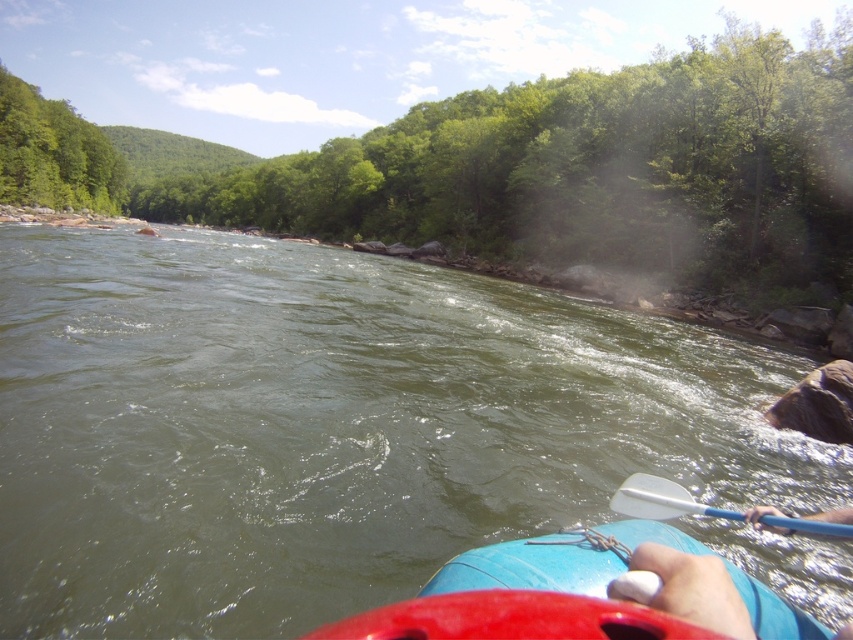
Question: Does green rubber raft at center have a greater width compared to blue rubber canoe at lower center?

Choices:
 (A) yes
 (B) no

Answer: (A)

Question: Which point is farther to the camera?

Choices:
 (A) green rubber raft at center
 (B) green leafy tree at upper center

Answer: (B)

Question: Does green leafy tree at upper left come behind white plastic paddle at lower center?

Choices:
 (A) yes
 (B) no

Answer: (A)

Question: Which of these objects is positioned closest to the blue rubber canoe at lower center?

Choices:
 (A) green leafy tree at upper left
 (B) white plastic paddle at lower center
 (C) green rubber raft at center

Answer: (B)

Question: Which of these objects is positioned farthest from the white plastic paddle at lower center?

Choices:
 (A) green leafy tree at upper center
 (B) green rubber raft at center
 (C) green leafy tree at upper left

Answer: (A)

Question: Does green leafy tree at upper left lie in front of white plastic paddle at lower center?

Choices:
 (A) no
 (B) yes

Answer: (A)